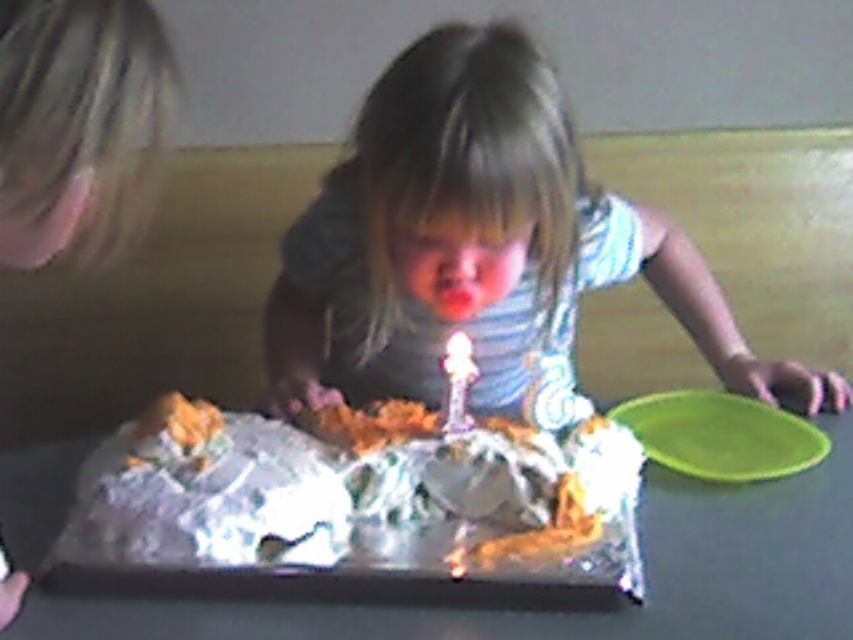
You are a photographer standing at a distance. You want to take a closeup photo of the striped fabric shirt at center without moving the subject. Can you estimate if your camera lens with a maximum focal length of 50mm can achieve this? Assume the shirt is 12 inches tall and the camera sensor size is 24x16mm.

The striped fabric shirt at center is 32.40 inches away from the viewer. Using the lens formula, the minimum focal length required to capture a 12 inch tall object at 32.40 inches distance is approximately 9mm. Since the camera lens has a maximum focal length of 50mm, it can easily achieve the closeup without moving the subject.

You are a photographer trying to capture the birthday cake scene. You notice the striped fabric shirt at center and the white plastic candle at center. Which object is positioned higher from the ground?

The striped fabric shirt at center is above the white plastic candle at center, so the striped fabric shirt at center is higher from the ground.